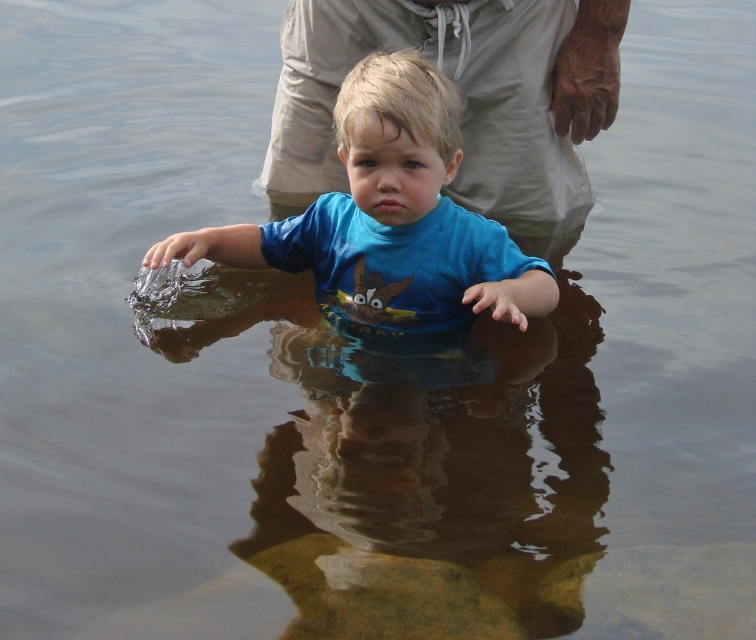
Based on the scene, which object is positioned higher in the image between the beige cotton pants at upper center and the blue matte shirt at center?

The beige cotton pants at upper center is located above the blue matte shirt at center in the image.

You are a photographer trying to capture a closeup of the beige cotton pants at upper center. Given that your camera has a minimum focusing distance of 5 meters, will you be able to take the photo without moving closer?

The distance between the beige cotton pants at upper center and the camera is 6.69 meters, which is greater than the minimum focusing distance of 5 meters. Therefore, you can take the photo without moving closer.

You are a photographer trying to capture a candid shot of the child playing in the water. You notice a point at coordinates (460,99) on your camera screen. According to the scene description, what object is located at that point?

The point at coordinates (460,99) marks the beige cotton pants at upper center.